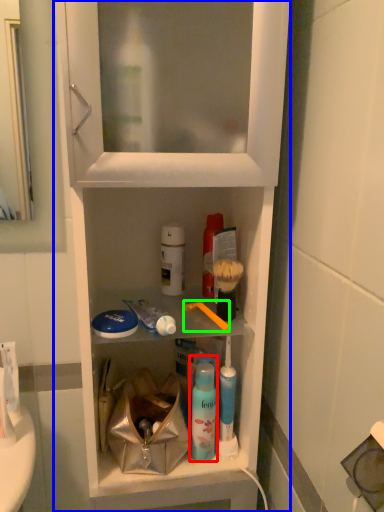
Question: Considering the real-world distances, which object is closest to mouthwash (highlighted by a red box)? cabinetry (highlighted by a blue box) or toothbrush (highlighted by a green box).

Choices:
 (A) cabinetry
 (B) toothbrush

Answer: (B)